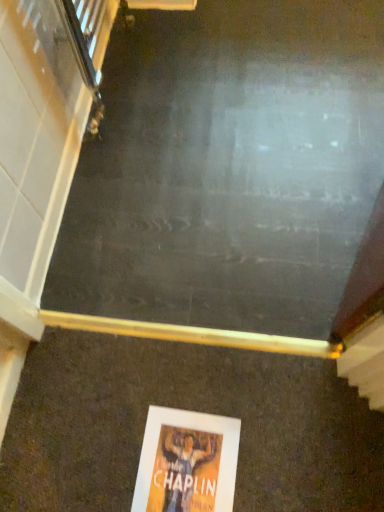
This screenshot has width=384, height=512. What do you see at coordinates (187, 462) in the screenshot?
I see `orange paper poster at lower center` at bounding box center [187, 462].

Find the location of a particular element. Image resolution: width=384 pixels, height=512 pixels. orange paper poster at lower center is located at coordinates (187, 462).

The width and height of the screenshot is (384, 512). In order to click on orange paper poster at lower center in this screenshot , I will do `click(187, 462)`.